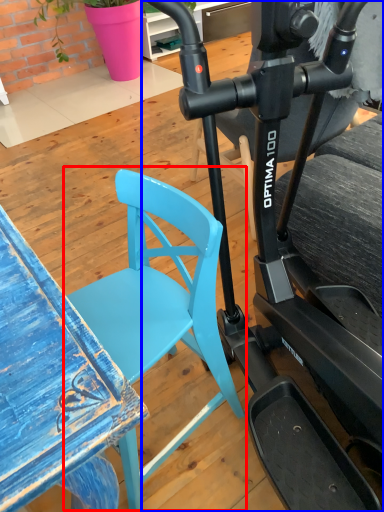
Question: Which object appears closest to the camera in this image, chair (highlighted by a red box) or stationary bicycle (highlighted by a blue box)?

Choices:
 (A) chair
 (B) stationary bicycle

Answer: (B)